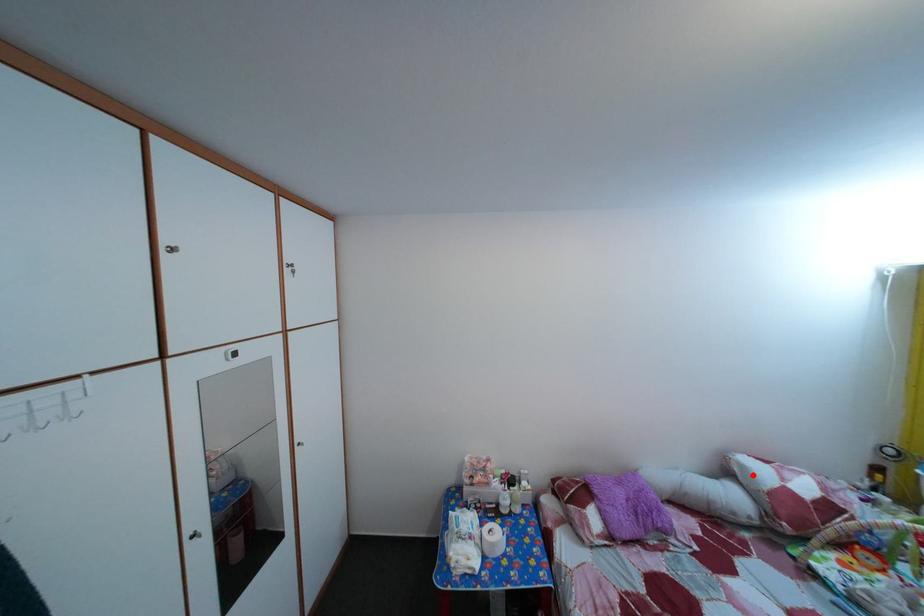
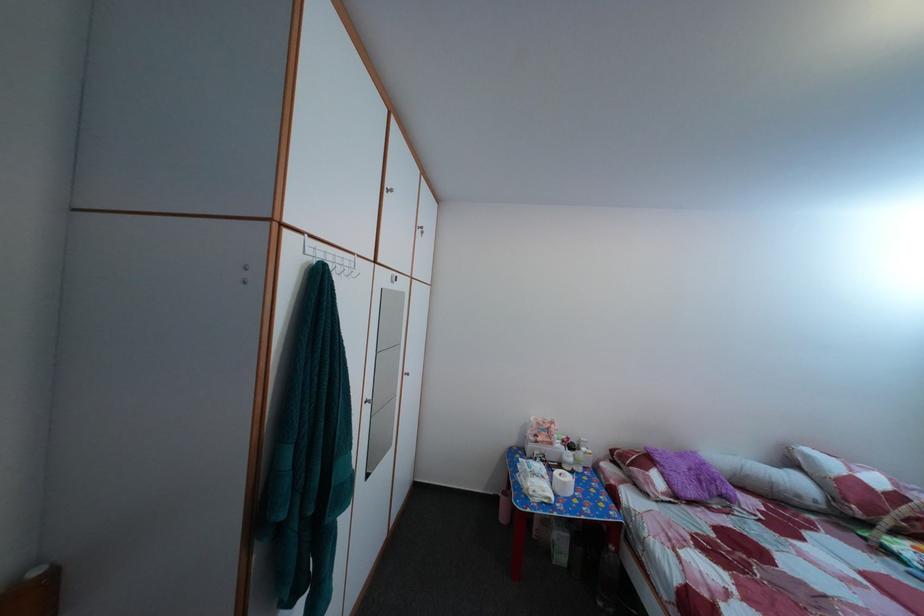
Question: I am providing you with two images of the same scene from different viewpoints. A red point is marked on the first image. At the location where the point appears in image 1, is it still visible in image 2?

Choices:
 (A) Yes
 (B) No

Answer: (A)